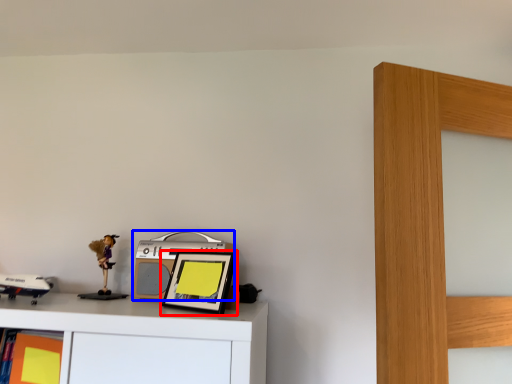
Question: Which object appears farthest to the camera in this image, picture frame (highlighted by a red box) or stereo (highlighted by a blue box)?

Choices:
 (A) picture frame
 (B) stereo

Answer: (B)